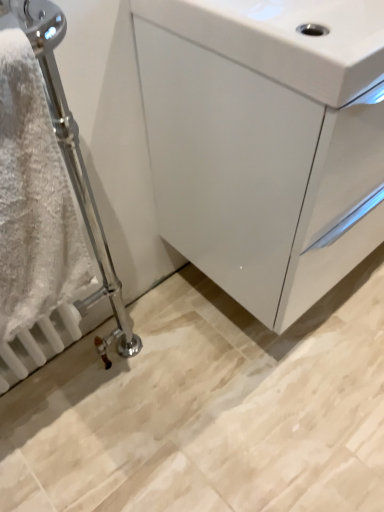
Question: Is point (246, 6) closer or farther from the camera than point (14, 286)?

Choices:
 (A) closer
 (B) farther

Answer: (B)

Question: Is white glossy sink at upper right wider or thinner than white fluffy towel at left?

Choices:
 (A) wide
 (B) thin

Answer: (A)

Question: Estimate the real-world distances between objects in this image. Which object is farther from the white glossy sink at upper right?

Choices:
 (A) white fluffy towel at left
 (B) white glossy cabinet at center

Answer: (A)

Question: Estimate the real-world distances between objects in this image. Which object is closer to the white fluffy towel at left?

Choices:
 (A) white glossy sink at upper right
 (B) white glossy cabinet at center

Answer: (B)